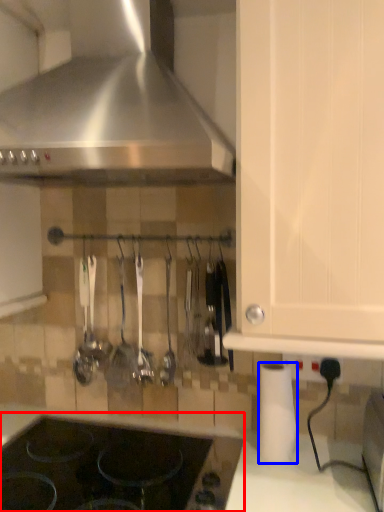
Question: Among these objects, which one is nearest to the camera, gas stove (highlighted by a red box) or paper towel (highlighted by a blue box)?

Choices:
 (A) gas stove
 (B) paper towel

Answer: (A)